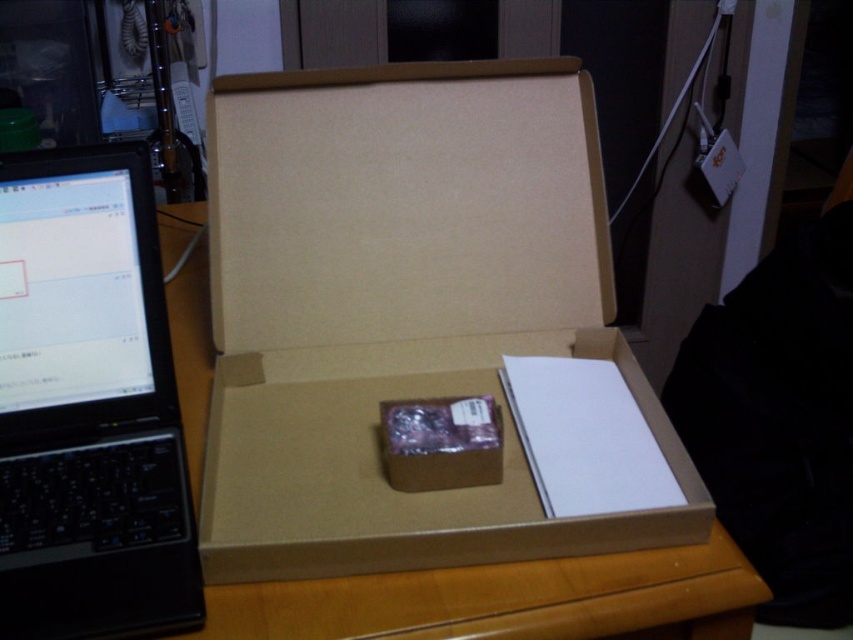
Does point (93, 177) lie behind point (396, 595)?

Yes, it is.

Between black plastic laptop at left and wooden table at center, which one is positioned lower?

black plastic laptop at left

Does point (103, 470) come closer to viewer compared to point (665, 632)?

No, it is behind (665, 632).

Where is `black plastic laptop at left`? The height and width of the screenshot is (640, 853). black plastic laptop at left is located at coordinates (88, 404).

Can you confirm if brown cardboard box at center is thinner than black plastic laptop at left?

In fact, brown cardboard box at center might be wider than black plastic laptop at left.

Which is more to the left, brown cardboard box at center or black plastic laptop at left?

Positioned to the left is black plastic laptop at left.

Locate an element on the screen. brown cardboard box at center is located at coordinates (401, 310).

Is brown cardboard box at center below wooden table at center?

Actually, brown cardboard box at center is above wooden table at center.

Who is positioned more to the right, brown cardboard box at center or wooden table at center?

brown cardboard box at center

In order to click on brown cardboard box at center in this screenshot , I will do `click(401, 310)`.

Where is `brown cardboard box at center`? Image resolution: width=853 pixels, height=640 pixels. brown cardboard box at center is located at coordinates (401, 310).